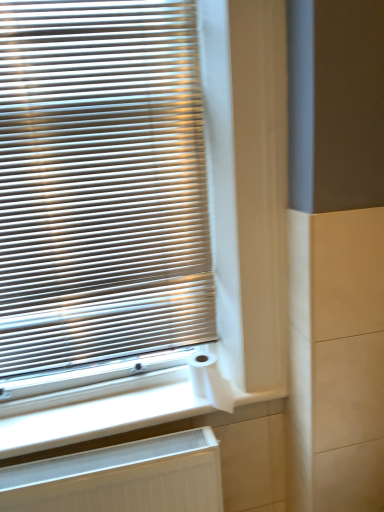
Question: Is white matte toilet paper at lower center bigger or smaller than matte silver blinds at left?

Choices:
 (A) big
 (B) small

Answer: (B)

Question: Based on their positions, is white matte toilet paper at lower center located to the left or right of matte silver blinds at left?

Choices:
 (A) right
 (B) left

Answer: (A)

Question: Considering the real-world distances, which object is farthest from the white matte toilet paper at lower center?

Choices:
 (A) white ribbed radiator at lower left
 (B) matte silver blinds at left

Answer: (B)

Question: Considering the real-world distances, which object is closest to the white matte toilet paper at lower center?

Choices:
 (A) white ribbed radiator at lower left
 (B) matte silver blinds at left

Answer: (A)